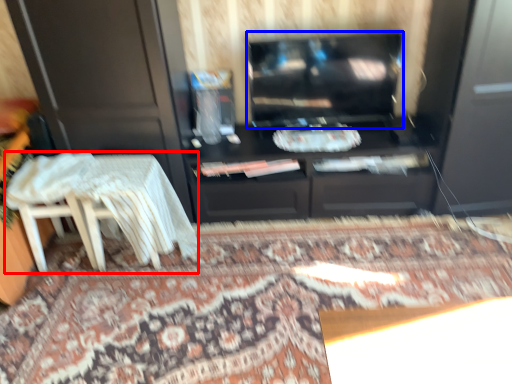
Question: Which object appears closest to the camera in this image, table (highlighted by a red box) or television (highlighted by a blue box)?

Choices:
 (A) table
 (B) television

Answer: (A)